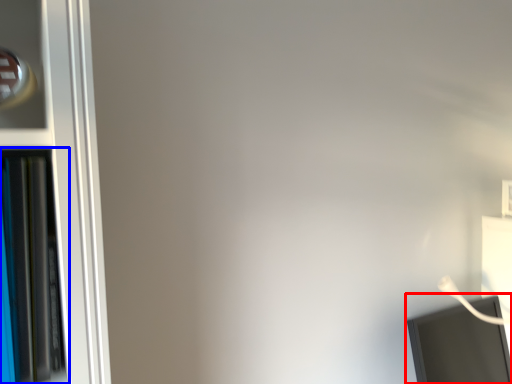
Question: Which point is closer to the camera, computer monitor (highlighted by a red box) or bookcase (highlighted by a blue box)?

Choices:
 (A) computer monitor
 (B) bookcase

Answer: (B)